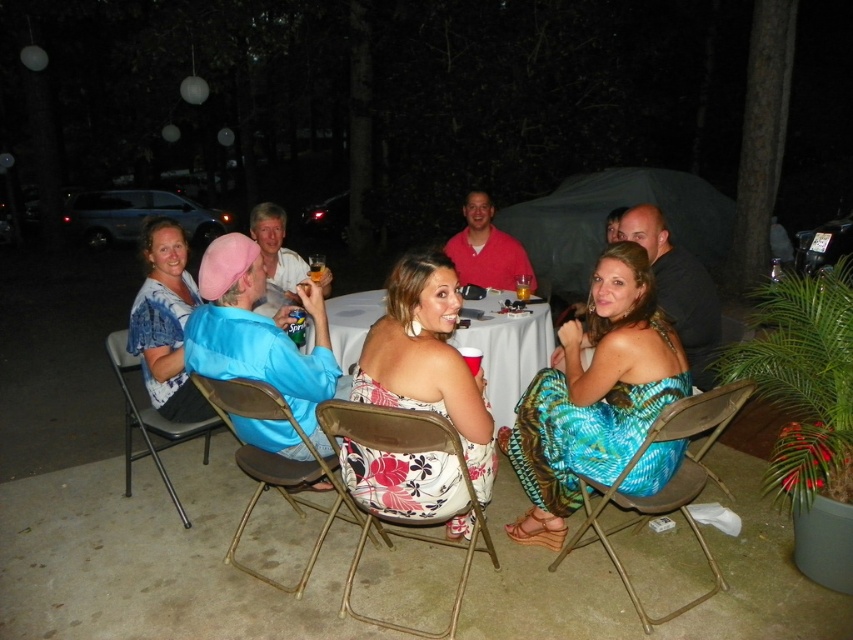
You are at the party and want to sit down. You see the white cloth table at center and the metallic gold folding chair at center. Which one is closer to you?

The white cloth table at center is closer to you because it is positioned over the metallic gold folding chair at center, meaning the table is in front of the chair.

You are at the party and want to sit down on the floral fabric chair at center. However, you have a large backpack that is taller than the chair. Will your backpack fit under the table if you place it in the spot where the blue fabric bag at left is currently located?

The floral fabric chair at center is shorter than the blue fabric bag at left. Since your backpack is taller than the chair, it will also be taller than the blue fabric bag at left. Therefore, if the blue fabric bag at left is currently under the table and fits, your backpack might not fit because it is taller.

In the scene shown: You are organizing a small outdoor event and need to place a 1.2 meter long tablecloth between the floral fabric chair at center and the blue fabric bag at left. Will the tablecloth be long enough to cover the space between them?

The distance between the floral fabric chair at center and the blue fabric bag at left is 1.07 meters. Since the tablecloth is 1.2 meters long, it will be long enough to cover the space between them with some extra length remaining.